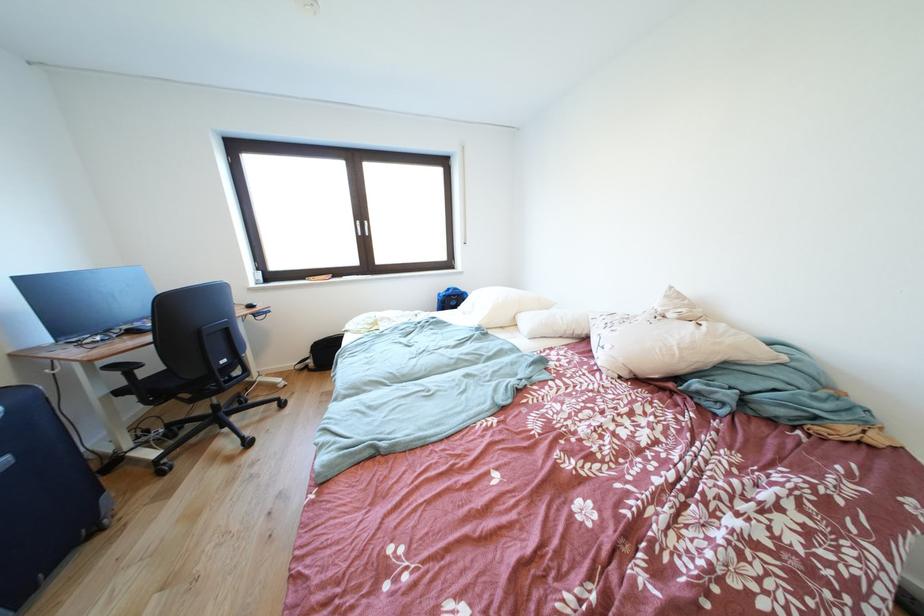
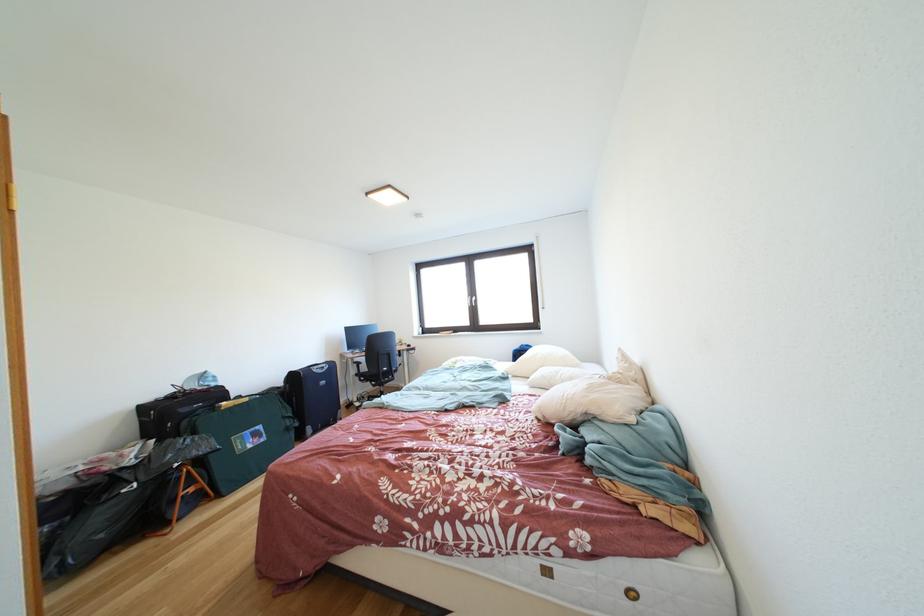
Question: I am providing you with two images of the same scene from different viewpoints. After the viewpoint changes to image2, which objects are now occluded?

Choices:
 (A) black backpack
 (B) blue shampoo bottle
 (C) silver window handle
 (D) chair armrest

Answer: (A)